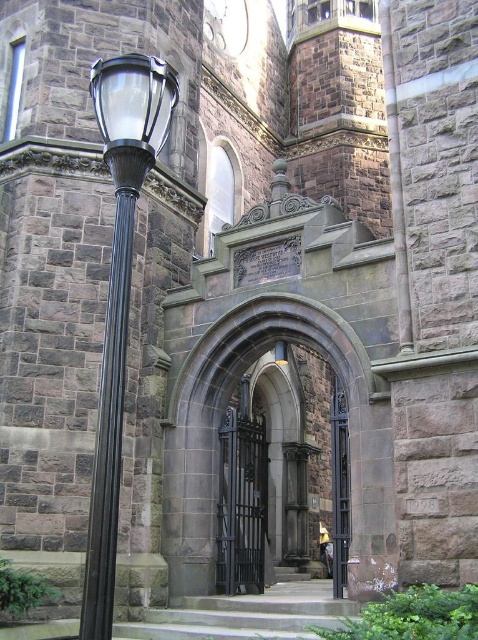
You are standing at the center of the image facing the historic stone building. A black polished metal pole is at the left side. If you want to walk directly towards the black polished metal pole at left, which direction should you move?

Since the black polished metal pole at left is positioned at the left side of the image, you should move to your left to walk directly towards it.

You are a visitor approaching the historic stone building and want to enter through the entrance. You see a black wrought iron gate at center and a polished dark wood door at center. Which object must you pass through first to reach the door?

The polished dark wood door at center is behind the black wrought iron gate at center, so you must pass through the black wrought iron gate at center first to reach the door.

Based on the photo, you are a visitor approaching the historic stone building and want to enter through the entrance. You see the matte black lamp post at left and the black wrought iron gate at center. Which object is positioned higher relative to the other?

The matte black lamp post at left is positioned above the black wrought iron gate at center, so it is higher.